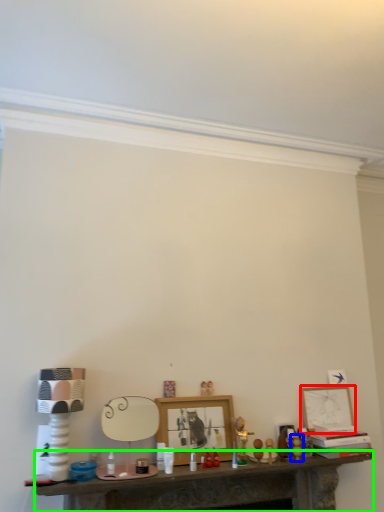
Question: Estimate the real-world distances between objects in this image. Which object is farther from picture frame (highlighted by a red box), toy (highlighted by a blue box) or table (highlighted by a green box)?

Choices:
 (A) toy
 (B) table

Answer: (B)